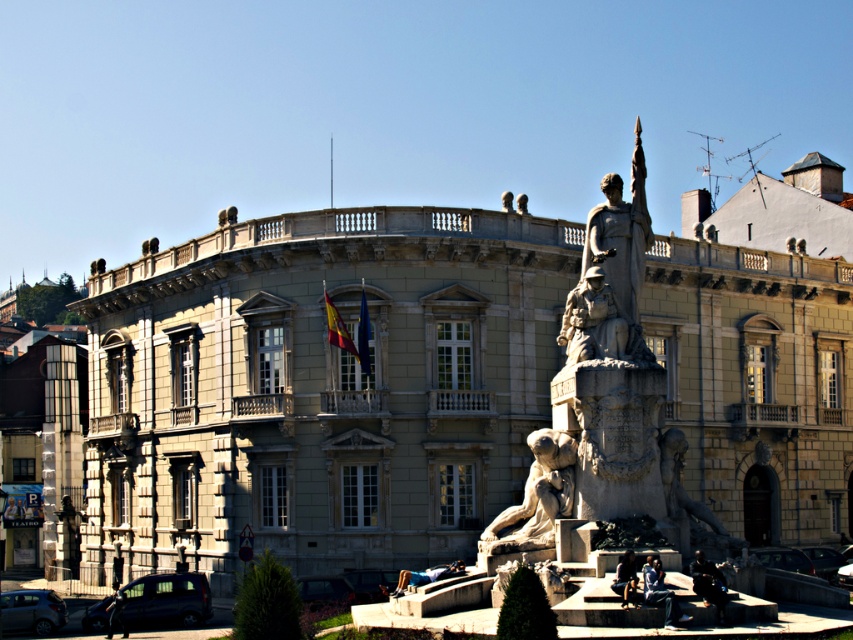
Which is in front, point (508, 328) or point (606, 230)?

Positioned in front is point (606, 230).

Does stone building at center have a lesser width compared to stone statue at center?

In fact, stone building at center might be wider than stone statue at center.

Between point (816, 374) and point (628, 326), which one is positioned behind?

Positioned behind is point (816, 374).

I want to click on stone building at center, so [320, 387].

Can you confirm if granite statue at center is positioned below stone statue at center?

Indeed, granite statue at center is positioned under stone statue at center.

Does granite statue at center come behind stone statue at center?

No, it is not.

Between point (677, 467) and point (619, 208), which one is positioned behind?

The point (619, 208) is behind.

Where is `granite statue at center`? granite statue at center is located at coordinates (605, 404).

Find the location of a particular element. This screenshot has height=640, width=853. stone building at center is located at coordinates (320, 387).

Based on the photo, does stone building at center lie behind stone lion at center?

No, it is in front of stone lion at center.

Between point (375, 307) and point (500, 531), which one is positioned behind?

Positioned behind is point (375, 307).

Identify the location of stone building at center. This screenshot has height=640, width=853. [x=320, y=387].